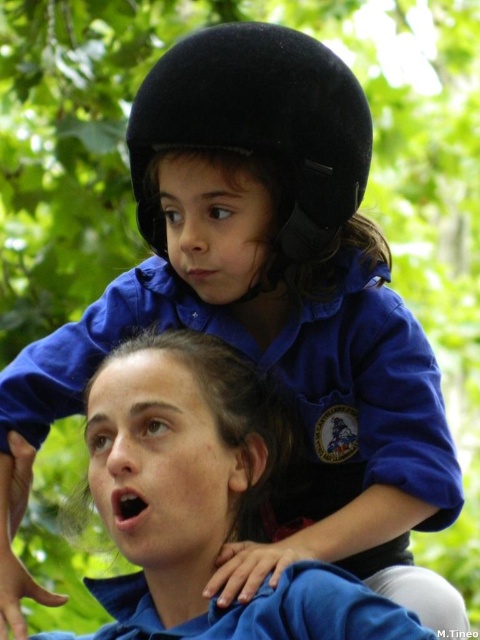
From the picture: You are a photographer trying to capture a clear photo of the blue fabric shirt at upper center and the black felt helmet at upper center. Which object will appear closer to the camera in the photo?

The blue fabric shirt at upper center is in front of the black felt helmet at upper center, so it will appear closer to the camera in the photo.

You are a photographer trying to capture a candid shot of the blue fabric shirt at upper center and the black felt helmet at upper center. Since the scene is crowded, you need to adjust your camera angle to ensure both are visible. Which object should you focus on first to frame both properly?

The black felt helmet at upper center should be focused on first because the blue fabric shirt at upper center is located below it. By centering the helmet in your viewfinder, you can adjust the framing to include the shirt positioned beneath it.

In the scene shown: You are an observer looking at the scene. You notice the blue fabric shirt at upper center and the black felt helmet at upper center. Which object takes up more space in the image?

The blue fabric shirt at upper center is larger in size than the black felt helmet at upper center, so it takes up more space in the image.